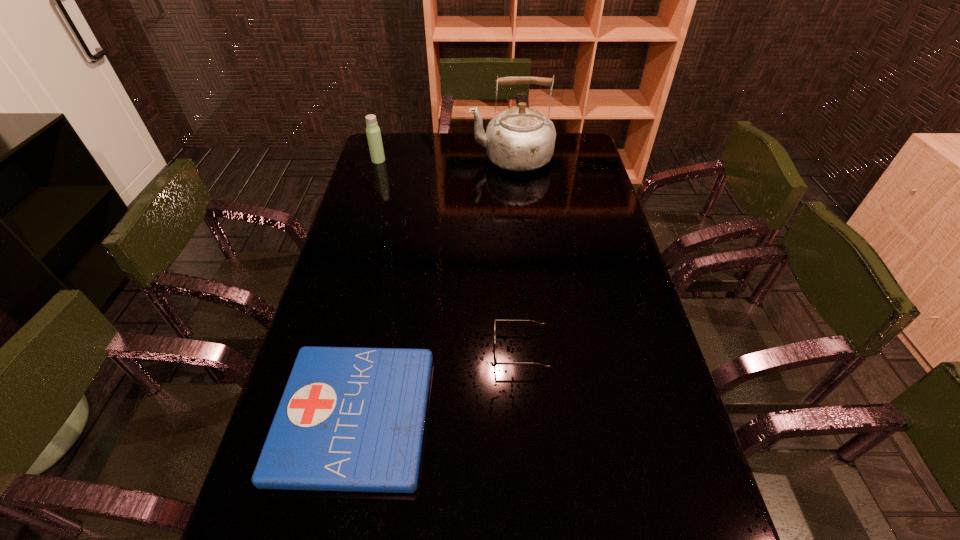
You are a GUI agent. You are given a task and a screenshot of the screen. Output one action in this format:
    pyautogui.click(x=<x>, y=<y>)
    Task: Click on the unoccupied area between the tallest object and the first-aid kit
    This screenshot has height=540, width=960.
    Given the screenshot: What is the action you would take?
    pyautogui.click(x=432, y=287)

At what (x,y) coordinates should I click in order to perform the action: click on vacant space that's between the thermos bottle and the sunglasses. Please return your answer as a coordinate pair (x, y). This screenshot has width=960, height=540. Looking at the image, I should click on (449, 255).

Identify the location of vacant area that lies between the third shortest object and the tallest object. (444, 159).

Find the location of a particular element. The width and height of the screenshot is (960, 540). vacant area that lies between the tallest object and the thermos bottle is located at coordinates (444, 159).

Where is `vacant space that is in between the first-aid kit and the second tallest object`? Image resolution: width=960 pixels, height=540 pixels. vacant space that is in between the first-aid kit and the second tallest object is located at coordinates (366, 288).

Where is `free space between the kettle and the second tallest object`? The width and height of the screenshot is (960, 540). free space between the kettle and the second tallest object is located at coordinates (444, 159).

The width and height of the screenshot is (960, 540). Find the location of `free spot between the sunglasses and the tallest object`. free spot between the sunglasses and the tallest object is located at coordinates (516, 254).

Where is `unoccupied position between the shortest object and the tallest object`? The width and height of the screenshot is (960, 540). unoccupied position between the shortest object and the tallest object is located at coordinates (432, 287).

Locate an element on the screen. vacant area that lies between the shortest object and the sunglasses is located at coordinates (438, 383).

Find the location of `vacant space that's between the thermos bottle and the kettle`. vacant space that's between the thermos bottle and the kettle is located at coordinates (444, 159).